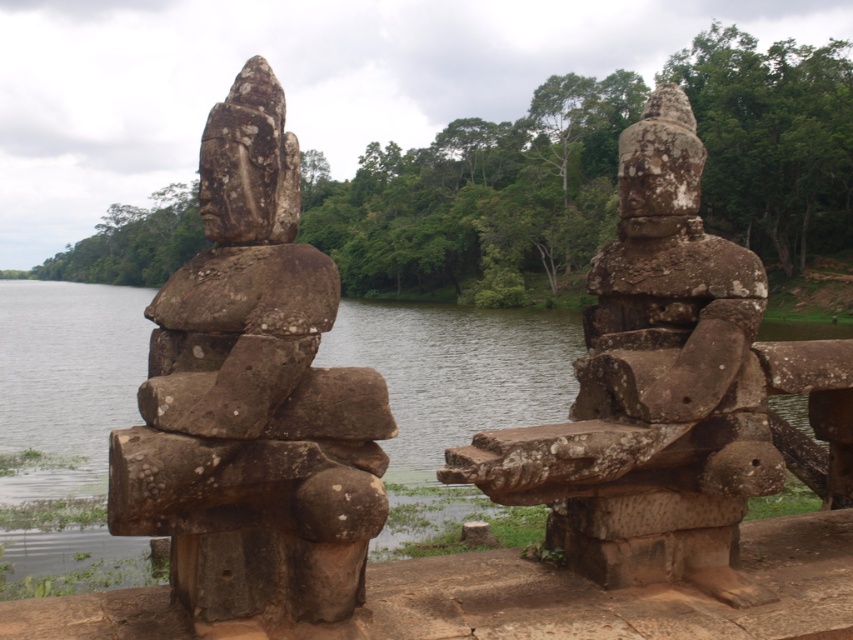
Between rusty stone statue at center and green mossy water at center, which one appears on the left side from the viewer's perspective?

Positioned to the left is green mossy water at center.

Measure the distance between rusty stone statue at center and camera.

rusty stone statue at center is 5.29 meters away from camera.

Locate an element on the screen. Image resolution: width=853 pixels, height=640 pixels. rusty stone statue at center is located at coordinates (665, 390).

Does rusty stone statue at left have a larger size compared to rusty stone statue at center?

Indeed, rusty stone statue at left has a larger size compared to rusty stone statue at center.

Between rusty stone statue at left and rusty stone statue at center, which one is positioned higher?

rusty stone statue at left

Which is in front, point (323, 563) or point (845, 365)?

Positioned in front is point (323, 563).

I want to click on rusty stone statue at left, so click(x=252, y=396).

Is point (235, 608) in front of point (467, 420)?

Yes.

The width and height of the screenshot is (853, 640). What are the coordinates of `rusty stone statue at left` in the screenshot? It's located at (252, 396).